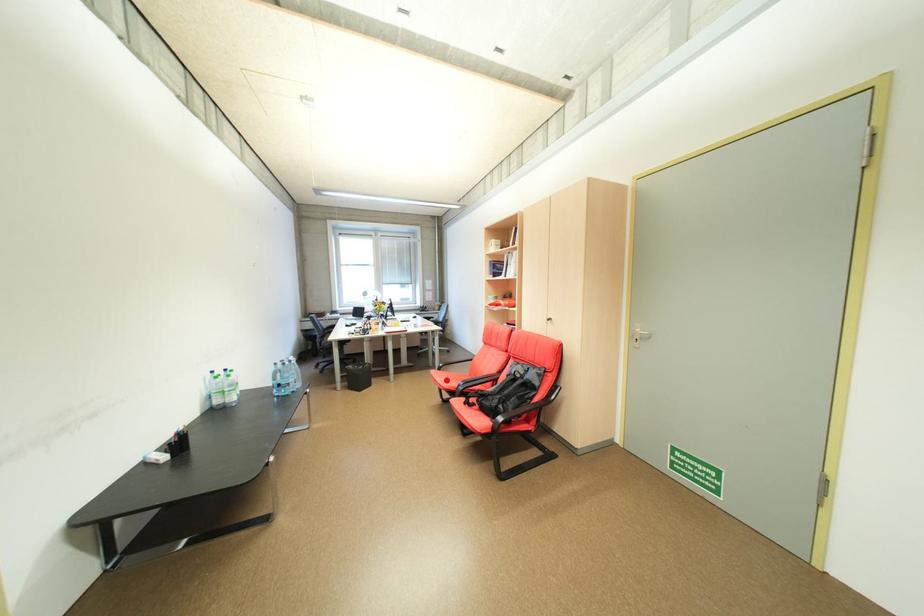
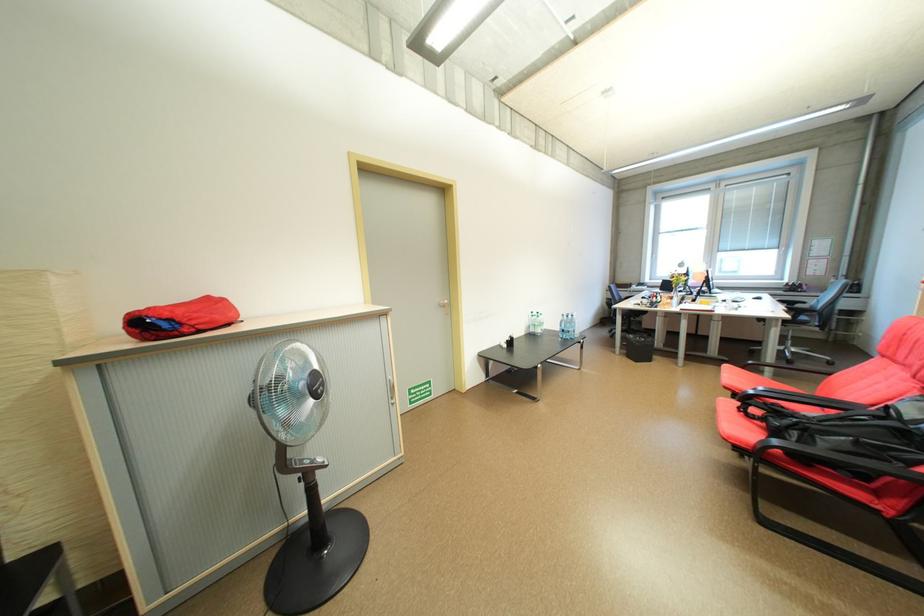
Question: I am providing you with two images of the same scene from different viewpoints. A red point is marked on the first image. Is the red point's position out of view in image 2?

Choices:
 (A) Yes
 (B) No

Answer: (B)